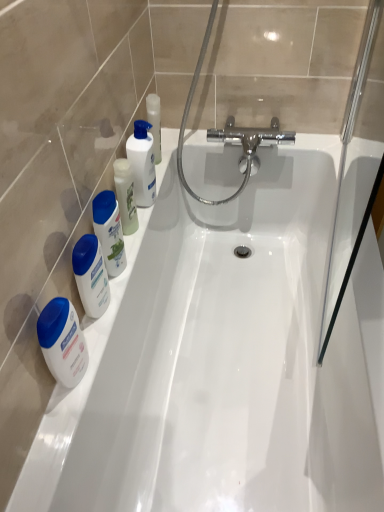
Question: From the image's perspective, is white glossy lotion at left, the 1th mouthwash positioned from the bottom, beneath white glossy mouthwash at left, acting as the 2th mouthwash starting from the top?

Choices:
 (A) no
 (B) yes

Answer: (B)

Question: From a real-world perspective, is white glossy lotion at left, the 1th mouthwash positioned from the bottom, over white glossy mouthwash at left, acting as the 2th mouthwash starting from the top?

Choices:
 (A) no
 (B) yes

Answer: (A)

Question: Considering the relative sizes of white glossy lotion at left, the 1th mouthwash positioned from the bottom, and white glossy mouthwash at left, which is the second mouthwash from bottom to top, in the image provided, is white glossy lotion at left, the 1th mouthwash positioned from the bottom, wider than white glossy mouthwash at left, which is the second mouthwash from bottom to top,?

Choices:
 (A) no
 (B) yes

Answer: (A)

Question: Does white glossy lotion at left, the 1th mouthwash positioned from the bottom, lie in front of white glossy mouthwash at left, which is the second mouthwash from bottom to top?

Choices:
 (A) yes
 (B) no

Answer: (A)

Question: Considering the relative positions of white glossy lotion at left, the 3th mouthwash viewed from the top, and white glossy mouthwash at left, acting as the 2th mouthwash starting from the top, in the image provided, is white glossy lotion at left, the 3th mouthwash viewed from the top, behind white glossy mouthwash at left, acting as the 2th mouthwash starting from the top,?

Choices:
 (A) no
 (B) yes

Answer: (A)

Question: Would you say white glossy lotion at left, which is counted as the second cleaning product, starting from the right, is inside or outside white glossy lotion at left, the 3th mouthwash viewed from the top?

Choices:
 (A) outside
 (B) inside

Answer: (A)

Question: In the image, is white glossy lotion at left, which ranks as the 1th cleaning product in bottom-to-top order, on the left side or the right side of white glossy lotion at left, the 1th mouthwash positioned from the bottom?

Choices:
 (A) right
 (B) left

Answer: (A)

Question: From a real-world perspective, relative to white glossy lotion at left, the 1th mouthwash positioned from the bottom, is white glossy lotion at left, which is the 2th cleaning product in top-to-bottom order, vertically above or below?

Choices:
 (A) below
 (B) above

Answer: (B)

Question: Does point (86, 253) appear closer or farther from the camera than point (51, 321)?

Choices:
 (A) closer
 (B) farther

Answer: (B)

Question: In the image, is white glossy lotion at left, the 1th mouthwash positioned from the bottom, positioned in front of or behind white glossy lotion at left, which is the 2th cleaning product in top-to-bottom order?

Choices:
 (A) front
 (B) behind

Answer: (A)

Question: Is white glossy lotion at left, the 3th mouthwash viewed from the top, spatially inside white glossy lotion at left, which ranks as the 1th cleaning product in bottom-to-top order, or outside of it?

Choices:
 (A) inside
 (B) outside

Answer: (B)

Question: From a real-world perspective, is white glossy lotion at left, the 3th mouthwash viewed from the top, physically located above or below white glossy lotion at left, acting as the first cleaning product starting from the left?

Choices:
 (A) below
 (B) above

Answer: (A)

Question: From the image's perspective, is white glossy lotion at left, the 3th mouthwash viewed from the top, located above or below white glossy lotion at left, which is the first cleaning product from front to back?

Choices:
 (A) above
 (B) below

Answer: (B)

Question: Do you think white glossy lotion at left, acting as the first cleaning product starting from the left, is within white glossy mouthwash at left, acting as the 2th mouthwash starting from the top, or outside of it?

Choices:
 (A) inside
 (B) outside

Answer: (B)

Question: Considering the positions of white glossy lotion at left, which is counted as the second cleaning product, starting from the right, and white glossy mouthwash at left, which is the second mouthwash from bottom to top, in the image, is white glossy lotion at left, which is counted as the second cleaning product, starting from the right, taller or shorter than white glossy mouthwash at left, which is the second mouthwash from bottom to top,?

Choices:
 (A) tall
 (B) short

Answer: (B)